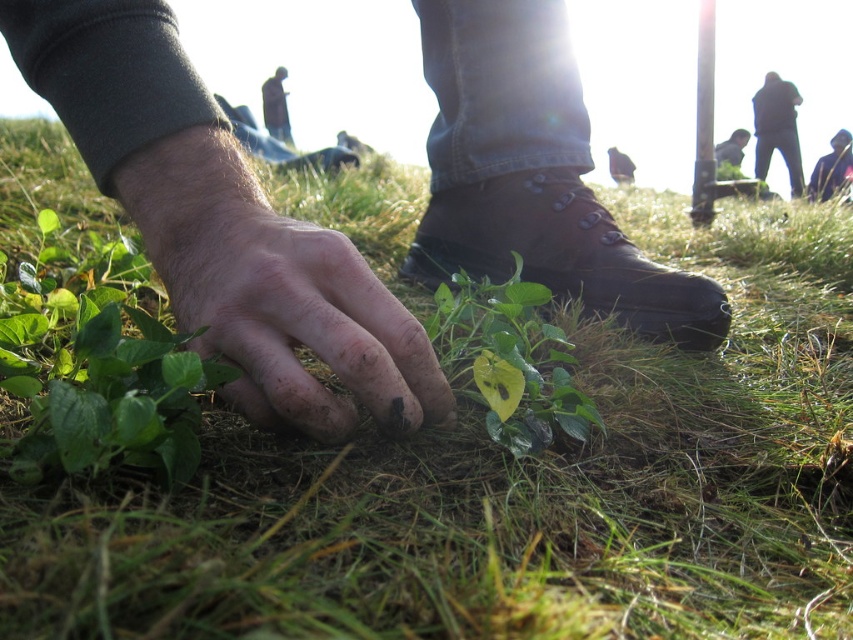
Is dirty skin hand at center to the left of dark matte jacket at upper right from the viewer's perspective?

Correct, you'll find dirty skin hand at center to the left of dark matte jacket at upper right.

Is point (312, 314) positioned in front of point (786, 120)?

Yes, it is in front of point (786, 120).

Locate an element on the screen. Image resolution: width=853 pixels, height=640 pixels. dirty skin hand at center is located at coordinates (221, 224).

Can you confirm if dark matte jacket at upper right is taller than dark blue jacket at lower right?

Indeed, dark matte jacket at upper right has a greater height compared to dark blue jacket at lower right.

Between dark matte jacket at upper right and dark blue jacket at lower right, which one is positioned higher?

dark matte jacket at upper right is above.

Is point (793, 193) closer to camera compared to point (821, 180)?

Yes, it is in front of point (821, 180).

Image resolution: width=853 pixels, height=640 pixels. In order to click on dark matte jacket at upper right in this screenshot , I will do `click(776, 129)`.

Who is taller, leather boot at center or dark matte jacket at upper right?

With more height is dark matte jacket at upper right.

Looking at this image, does leather boot at center appear over dark matte jacket at upper right?

Actually, leather boot at center is below dark matte jacket at upper right.

What are the coordinates of `leather boot at center` in the screenshot? It's located at (561, 253).

At what (x,y) coordinates should I click in order to perform the action: click on leather boot at center. Please return your answer as a coordinate pair (x, y). This screenshot has width=853, height=640. Looking at the image, I should click on (561, 253).